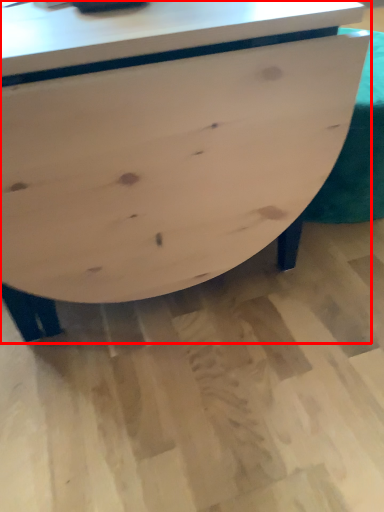
Question: Observing the image, what is the correct spatial positioning of table (annotated by the red box) in reference to swivel chair?

Choices:
 (A) left
 (B) right

Answer: (A)